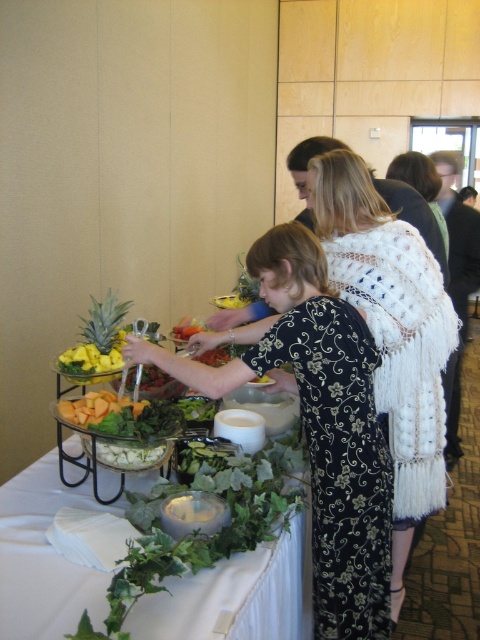
Question: Is black floral dress at center to the left of green leafy salad at lower left from the viewer's perspective?

Choices:
 (A) yes
 (B) no

Answer: (B)

Question: Which object is the closest to the black floral dress at center?

Choices:
 (A) green leafy salad at lower left
 (B) green leafy pineapple at left

Answer: (A)

Question: Which point appears closest to the camera in this image?

Choices:
 (A) (265, 557)
 (B) (111, 300)
 (C) (351, 561)

Answer: (A)

Question: Does black floral dress at center have a greater width compared to green leafy salad at lower left?

Choices:
 (A) no
 (B) yes

Answer: (A)

Question: Is green leafy salad at lower left to the right of green leafy pineapple at left from the viewer's perspective?

Choices:
 (A) no
 (B) yes

Answer: (B)

Question: Which of the following is the farthest from the observer?

Choices:
 (A) black floral dress at center
 (B) green leafy salad at lower left

Answer: (A)